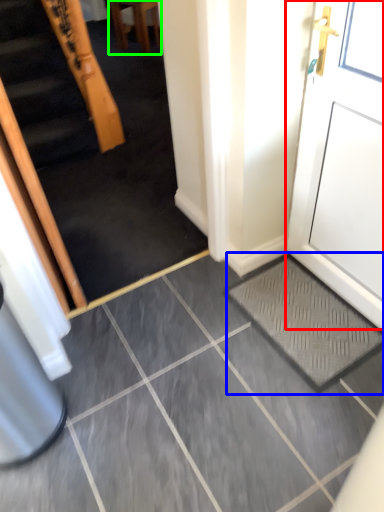
Question: Based on their relative distances, which object is nearer to door (highlighted by a red box)? Choose from doormat (highlighted by a blue box) and furniture (highlighted by a green box).

Choices:
 (A) doormat
 (B) furniture

Answer: (A)